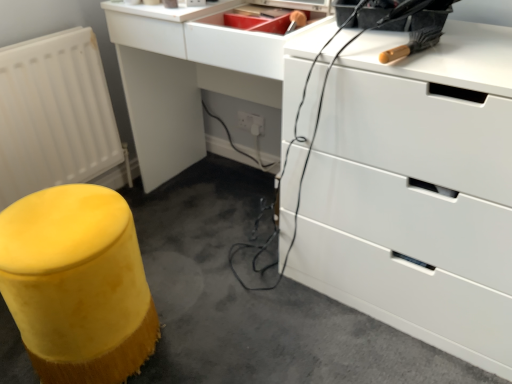
I want to click on blank space to the left of white glossy chest of drawers at upper right, so click(243, 305).